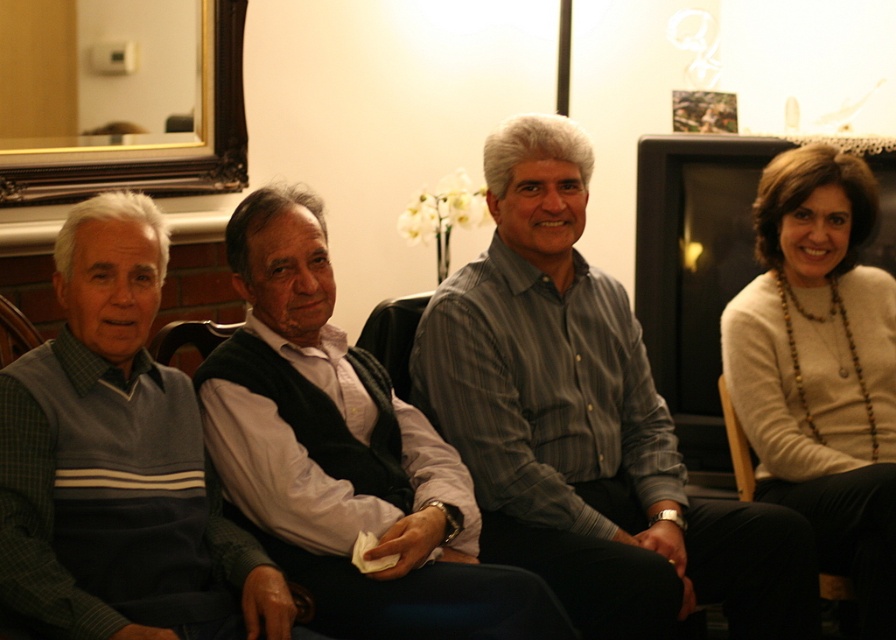
Does green sweater at left appear under wooden chair at left?

Correct, green sweater at left is located below wooden chair at left.

Is green sweater at left above wooden chair at left?

No, green sweater at left is not above wooden chair at left.

Measure the distance between green sweater at left and camera.

green sweater at left and camera are 5.23 feet apart from each other.

Locate an element on the screen. green sweater at left is located at coordinates (118, 460).

Between white sweater at right and wooden chair at right, which one appears on the right side from the viewer's perspective?

white sweater at right is more to the right.

Between white sweater at right and wooden chair at right, which one appears on the left side from the viewer's perspective?

Positioned to the left is wooden chair at right.

Describe the element at coordinates (821, 369) in the screenshot. I see `white sweater at right` at that location.

Identify the location of white sweater at right. [x=821, y=369].

Is white shirt at center further to camera compared to green sweater at left?

Yes.

Is point (317, 394) positioned before point (283, 596)?

No, it is behind (283, 596).

Image resolution: width=896 pixels, height=640 pixels. I want to click on white shirt at center, so click(343, 454).